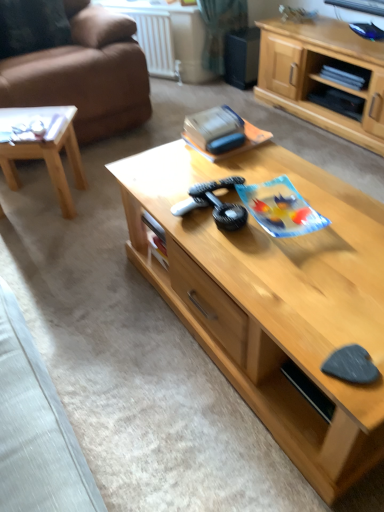
Locate an element on the screen. This screenshot has width=384, height=512. vacant region under light brown wood coffee table at left, marked as the 2th coffee table in a right-to-left arrangement (from a real-world perspective) is located at coordinates (39, 201).